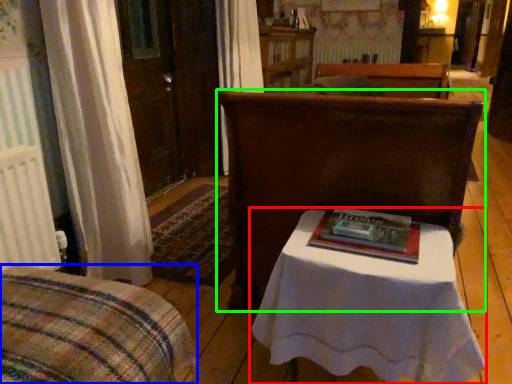
Question: Which object is the closest to the table (highlighted by a red box)? Choose among these: furniture (highlighted by a blue box) or furniture (highlighted by a green box).

Choices:
 (A) furniture
 (B) furniture

Answer: (B)